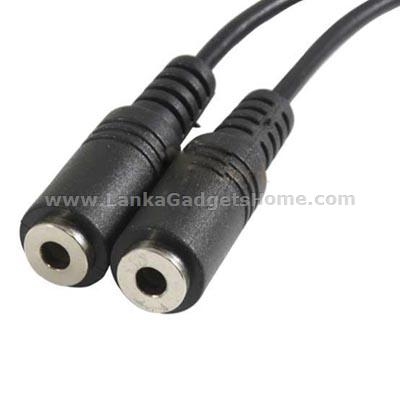
Where is `black wires`? The height and width of the screenshot is (400, 400). black wires is located at coordinates (310, 62), (224, 45).